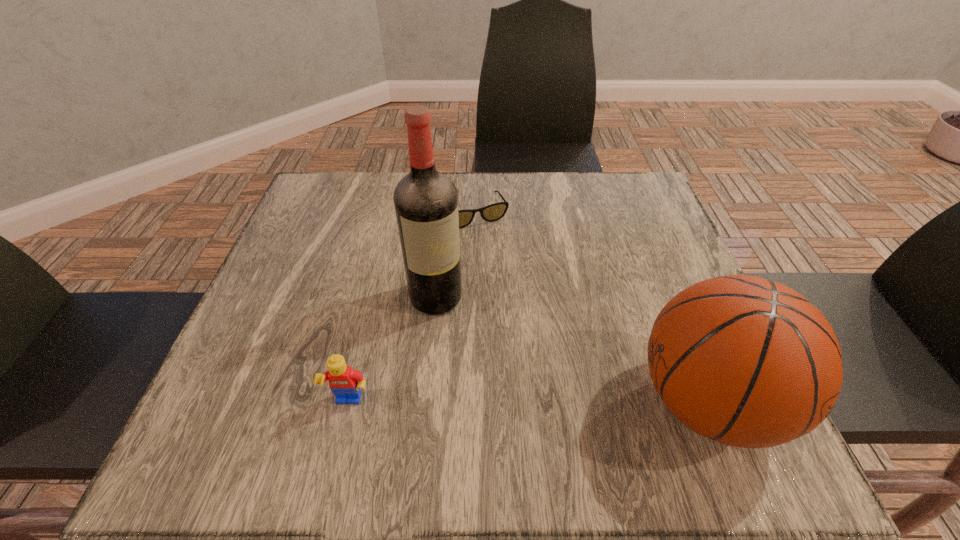
The image size is (960, 540). Find the location of `the third tallest object`. the third tallest object is located at coordinates (344, 382).

This screenshot has height=540, width=960. I want to click on the leftmost object, so click(x=344, y=382).

Identify the location of the second tallest object. The height and width of the screenshot is (540, 960). (747, 362).

You are a GUI agent. You are given a task and a screenshot of the screen. Output one action in this format:
    pyautogui.click(x=<x>, y=<y>)
    Task: Click on the rightmost object
    
    Given the screenshot: What is the action you would take?
    tap(747, 362)

Locate an element on the screen. the tallest object is located at coordinates (426, 201).

Identify the location of liquor. (426, 201).

I want to click on sunglasses, so click(x=493, y=212).

Locate an element on the screen. the shortest object is located at coordinates [493, 212].

Locate an element on the screen. vacant space positioned on the left of the basketball is located at coordinates (403, 402).

Where is `vacant space located 0.240m on the front-facing side of the liquor`? The height and width of the screenshot is (540, 960). vacant space located 0.240m on the front-facing side of the liquor is located at coordinates (516, 411).